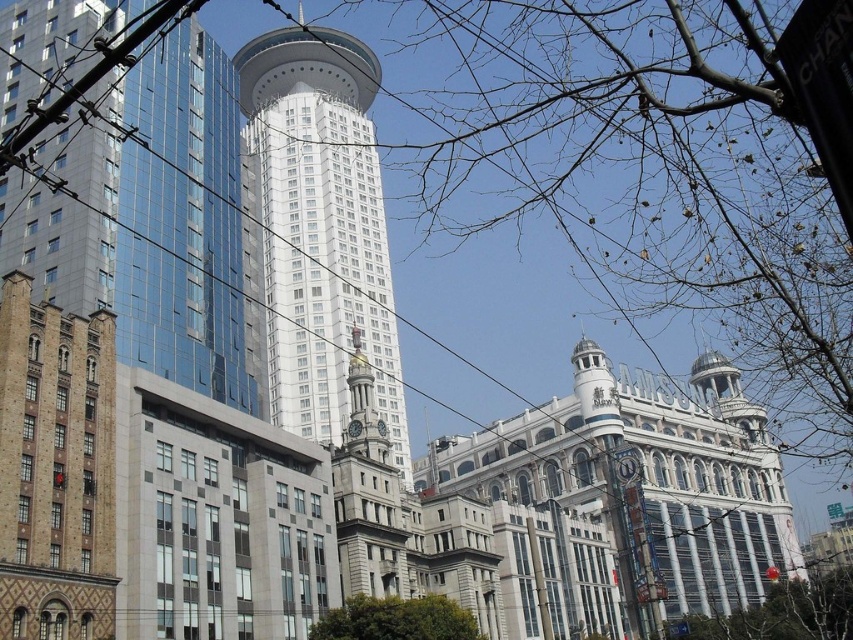
What are the coordinates of the gold ornate clock tower at center?

The gold ornate clock tower at center is located at coordinates point (367, 496).

You are standing in the urban landscape and want to take a photo of the classic European building with beige facade and intricate detailing. To avoid the bare branches at lower right from blocking the view, where should you position yourself relative to the branches?

To avoid the bare branches at lower right blocking the view, you should position yourself to the left of the branches since they are located at the lower right corner of the image at point coordinates (x=781, y=612).